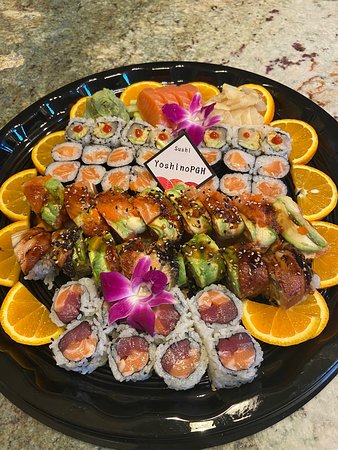
Where is `dark vein in countertop`? The width and height of the screenshot is (338, 450). dark vein in countertop is located at coordinates (304, 82), (318, 100).